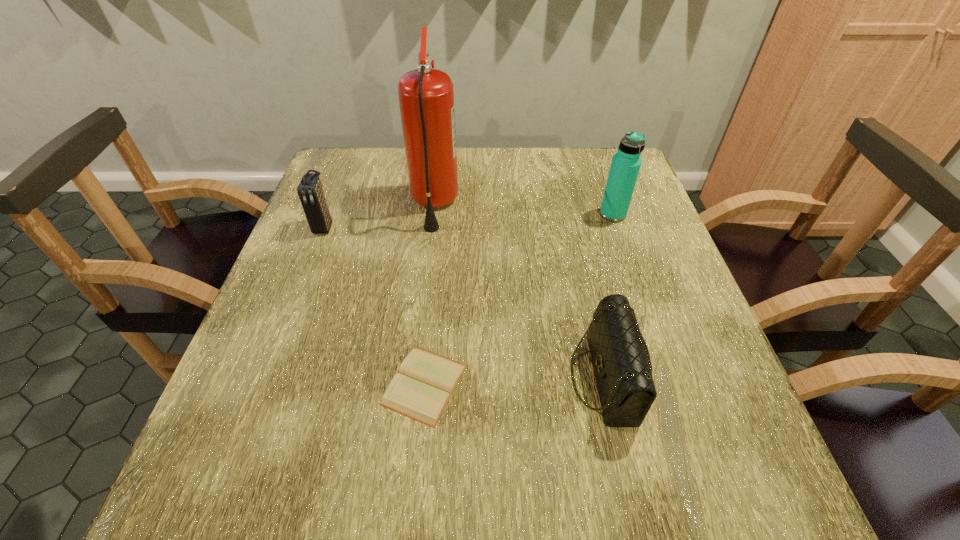
Image resolution: width=960 pixels, height=540 pixels. Find the location of `free space between the fourth object from left to right and the shortest object`. free space between the fourth object from left to right and the shortest object is located at coordinates (515, 381).

The height and width of the screenshot is (540, 960). I want to click on free space between the diary and the fourth shortest object, so (518, 299).

Identify the location of vacant point located between the rightmost object and the farther clutch bag. This screenshot has width=960, height=540. (468, 220).

The image size is (960, 540). Find the location of `free area in between the left clutch bag and the diary`. free area in between the left clutch bag and the diary is located at coordinates (374, 305).

Point out which object is positioned as the second nearest to the leftmost object. Please provide its 2D coordinates. Your answer should be formatted as a tuple, i.e. [(x, y)], where the tuple contains the x and y coordinates of a point satisfying the conditions above.

[(421, 390)]

Identify the location of object that is the second closest to the taller clutch bag. This screenshot has height=540, width=960. (421, 390).

Find the location of `vacant point that satisfies the following two spatial constraints: 1. on the instruction side of the tallest object; 2. on the back side of the diary`. vacant point that satisfies the following two spatial constraints: 1. on the instruction side of the tallest object; 2. on the back side of the diary is located at coordinates pos(413,384).

This screenshot has height=540, width=960. I want to click on free spot that satisfies the following two spatial constraints: 1. on the front side of the water bottle; 2. on the front flap of the right clutch bag, so click(668, 378).

At what (x,y) coordinates should I click in order to perform the action: click on free space that satisfies the following two spatial constraints: 1. on the instruction side of the fire extinguisher; 2. on the right side of the diary. Please return your answer as a coordinate pair (x, y). The image size is (960, 540). Looking at the image, I should click on (413, 384).

Where is `free space in the image that satisfies the following two spatial constraints: 1. with the zip open on the shortest object; 2. on the left side of the third tallest object`? free space in the image that satisfies the following two spatial constraints: 1. with the zip open on the shortest object; 2. on the left side of the third tallest object is located at coordinates (263, 384).